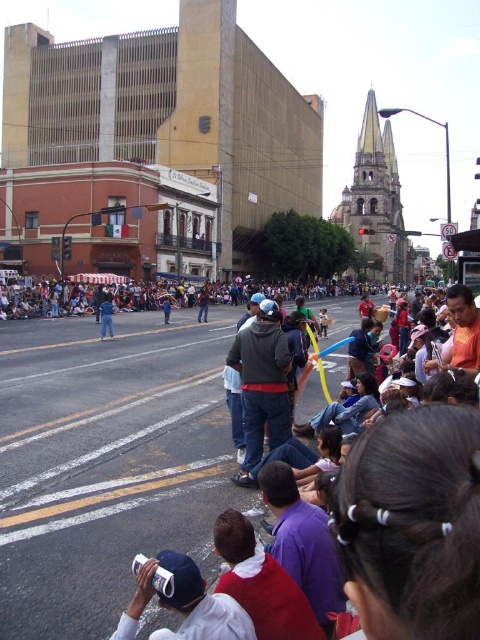
Can you confirm if dark gray hoodie at center is wider than white matte cap at lower center?

Correct, the width of dark gray hoodie at center exceeds that of white matte cap at lower center.

Is dark gray hoodie at center positioned before white matte cap at lower center?

No, it is behind white matte cap at lower center.

Measure the distance between point (274, 442) and camera.

They are 127.19 feet apart.

Where is `dark gray hoodie at center`? This screenshot has height=640, width=480. dark gray hoodie at center is located at coordinates (263, 384).

Can you confirm if matte plastic balloon at center is positioned to the right of dark gray hoodie at center?

No, matte plastic balloon at center is not to the right of dark gray hoodie at center.

Describe the element at coordinates (107, 461) in the screenshot. I see `matte plastic balloon at center` at that location.

Find the location of `matte plastic balloon at center`. matte plastic balloon at center is located at coordinates (107, 461).

Is dark gray hoodie at center wider than blue denim jeans at center?

No, dark gray hoodie at center is not wider than blue denim jeans at center.

Is dark gray hoodie at center below blue denim jeans at center?

Indeed, dark gray hoodie at center is positioned under blue denim jeans at center.

Between point (250, 456) and point (108, 316), which one is positioned behind?

The point (108, 316) is behind.

The height and width of the screenshot is (640, 480). Find the location of `dark gray hoodie at center`. dark gray hoodie at center is located at coordinates (263, 384).